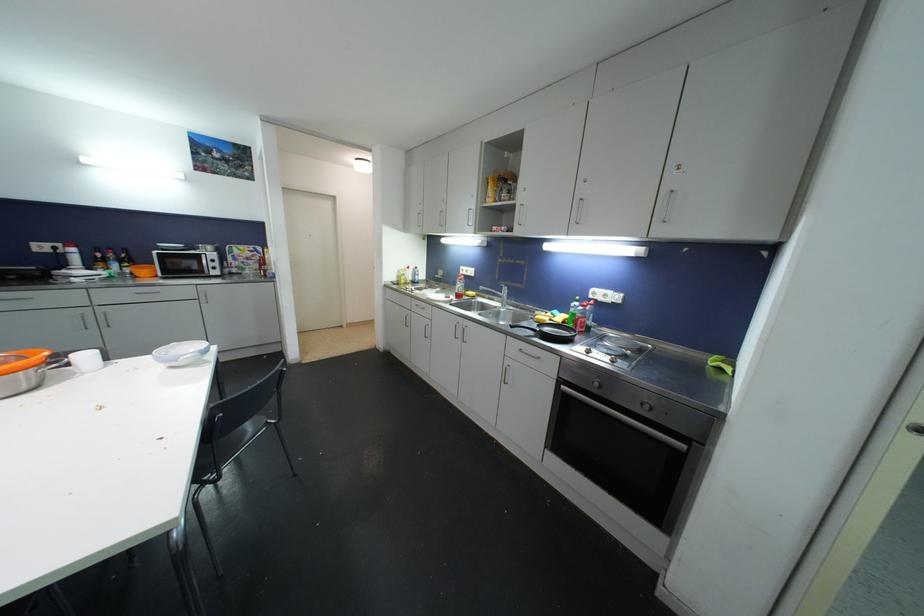
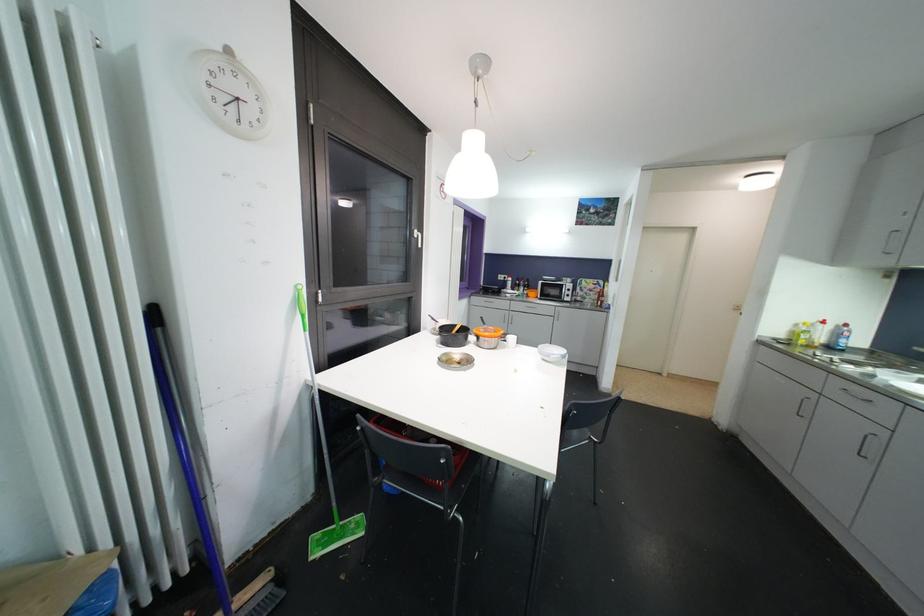
Question: The camera is either moving clockwise (left) or counter-clockwise (right) around the object. The first image is from the beginning of the video and the second image is from the end. Is the camera moving left or right when shooting the video?

Choices:
 (A) Left
 (B) Right

Answer: (B)